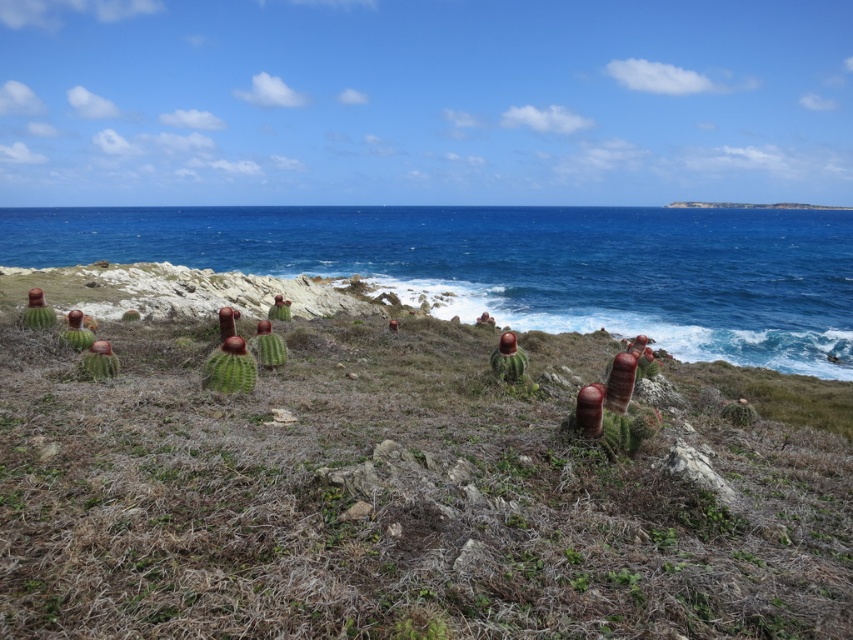
You are standing at the point with coordinates point [347,230] and want to walk to the point with coordinates point [293,552]. Which direction should you move relative to your current position?

You should move forward because point [293,552] is in front of point [347,230].

You are standing at the origin point of the image coordinate system. Looking at the coastal landscape, where is the green grassy at center located in terms of 2D coordinates?

The green grassy at center is located at the 2D coordinates of point (396, 500).